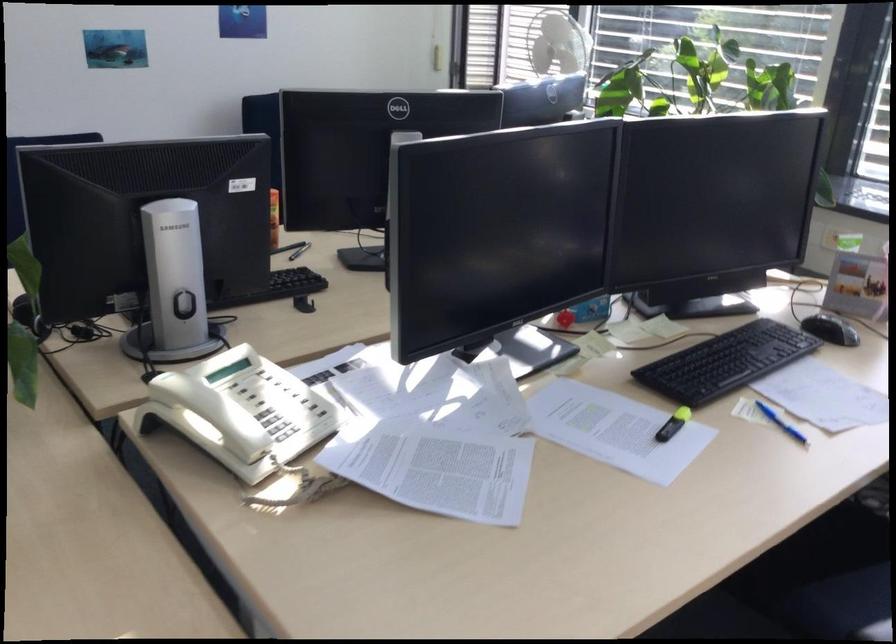
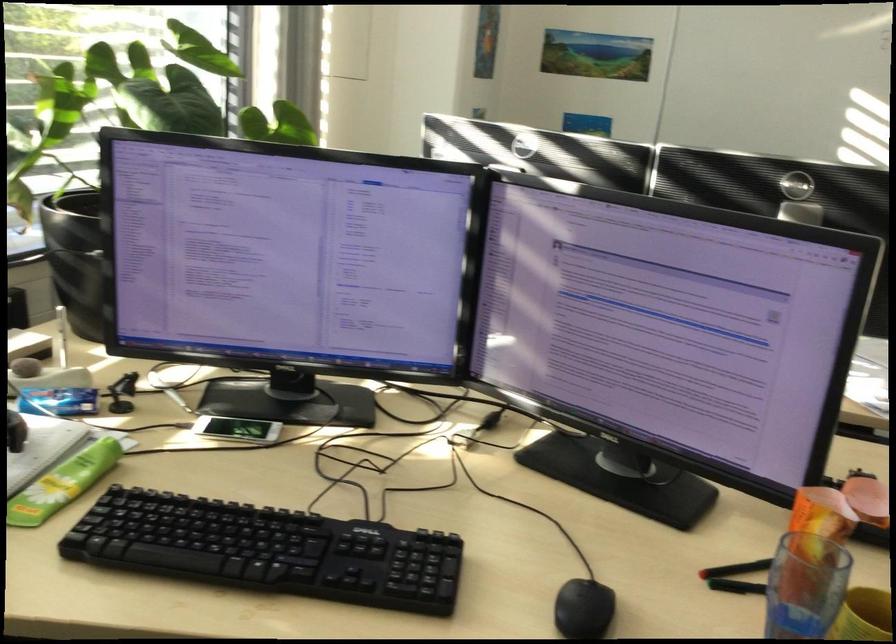
The point at (277, 232) is marked in the first image. Where is the corresponding point in the second image?

(805, 585)